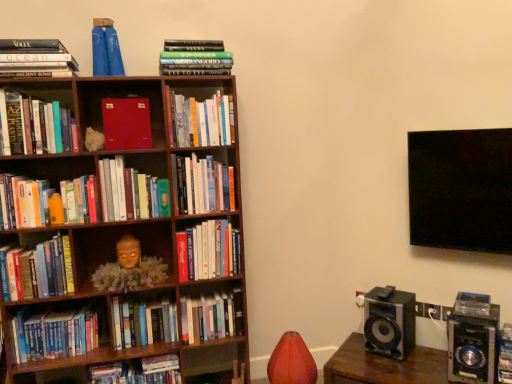
What do you see at coordinates (37, 270) in the screenshot?
I see `hardcover book at left, arranged as the first book when viewed from the left` at bounding box center [37, 270].

This screenshot has height=384, width=512. Identify the location of hardcover book at lower left, which ranks as the 4th book in left-to-right order. (53, 335).

Describe the element at coordinates (385, 366) in the screenshot. The image size is (512, 384). I see `wooden speaker at lower right` at that location.

In order to face hardcover book at center, acting as the 11th book starting from the left, should I rotate leftwards or rightwards?

It's best to rotate left around 7.619 degrees.

What do you see at coordinates (195, 58) in the screenshot? I see `hardcover books at upper center, which is the tenth book in left-to-right order` at bounding box center [195, 58].

The image size is (512, 384). Identify the location of hardcover book at left, placed as the fifteenth book when sorted from right to left. (37, 270).

Is green matte book at center, which ranks as the 8th book in right-to-left order, looking in the opposite direction of hardcover book at lower left, which ranks as the 4th book in left-to-right order?

No, green matte book at center, which ranks as the 8th book in right-to-left order, is not facing away from hardcover book at lower left, which ranks as the 4th book in left-to-right order.

From the image's perspective, is green matte book at center, which ranks as the 8th book in left-to-right order, above hardcover book at lower left, which ranks as the 4th book in left-to-right order?

Yes, from the image's perspective, green matte book at center, which ranks as the 8th book in left-to-right order, is above hardcover book at lower left, which ranks as the 4th book in left-to-right order.

Can we say green matte book at center, which ranks as the 8th book in left-to-right order, lies outside hardcover book at lower left, which ranks as the 4th book in left-to-right order?

Yes.

Does hardcover book at upper left, which is the 14th book in right-to-left order, touch metallic silver speaker at lower right, positioned as the second speaker in right-to-left order?

hardcover book at upper left, which is the 14th book in right-to-left order, and metallic silver speaker at lower right, positioned as the second speaker in right-to-left order, are clearly separated.

Is hardcover book at upper left, the second book when ordered from left to right, aimed at metallic silver speaker at lower right, positioned as the second speaker in right-to-left order?

No, hardcover book at upper left, the second book when ordered from left to right, does not turn towards metallic silver speaker at lower right, positioned as the second speaker in right-to-left order.

Between point (38, 76) and point (397, 303), which one is positioned in front?

Positioned in front is point (38, 76).

From the image's perspective, which one is positioned lower, hardcover book at upper left, the second book when ordered from left to right, or metallic silver speaker at lower right, positioned as the second speaker in right-to-left order?

metallic silver speaker at lower right, positioned as the second speaker in right-to-left order, appears lower in the image.

Considering the sizes of objects hardcover book at left, the thirteenth book positioned from the right, and metallic silver speaker at lower right, positioned as the second speaker in right-to-left order, in the image provided, who is thinner, hardcover book at left, the thirteenth book positioned from the right, or metallic silver speaker at lower right, positioned as the second speaker in right-to-left order,?

hardcover book at left, the thirteenth book positioned from the right.

From a real-world perspective, is hardcover book at left, the thirteenth book positioned from the right, physically above metallic silver speaker at lower right, positioned as the second speaker in right-to-left order?

Yes, from a real-world perspective, hardcover book at left, the thirteenth book positioned from the right, is on top of metallic silver speaker at lower right, positioned as the second speaker in right-to-left order.

In the image, is hardcover book at left, arranged as the third book when viewed from the left, on the left side or the right side of metallic silver speaker at lower right, the first speaker positioned from the left?

Based on their positions, hardcover book at left, arranged as the third book when viewed from the left, is located to the left of metallic silver speaker at lower right, the first speaker positioned from the left.

Does hardcover book at center, the 9th book from the right, touch hardcover book at center, which is the 13th book in left-to-right order?

No.

Which of these two, hardcover book at center, the 9th book from the right, or hardcover book at center, which is the 13th book in left-to-right order, is bigger?

Bigger between the two is hardcover book at center, the 9th book from the right.

Which is behind, hardcover book at center, the seventh book in the left-to-right sequence, or hardcover book at center, which is the 13th book in left-to-right order?

hardcover book at center, which is the 13th book in left-to-right order.

Based on their sizes in the image, would you say matte gold mask at center-left is bigger or smaller than hardcover book at upper left, the second book when ordered from left to right?

Considering their sizes, matte gold mask at center-left takes up more space than hardcover book at upper left, the second book when ordered from left to right.

From the image's perspective, is matte gold mask at center-left on hardcover book at upper left, the second book when ordered from left to right?

Actually, matte gold mask at center-left appears below hardcover book at upper left, the second book when ordered from left to right, in the image.

Is matte gold mask at center-left oriented away from hardcover book at upper left, which is the 14th book in right-to-left order?

No, matte gold mask at center-left is not facing away from hardcover book at upper left, which is the 14th book in right-to-left order.

Based on the photo, is matte gold mask at center-left to the right of hardcover book at upper left, which is the 14th book in right-to-left order, from the viewer's perspective?

Yes, matte gold mask at center-left is to the right of hardcover book at upper left, which is the 14th book in right-to-left order.

Considering the positions of point (373, 366) and point (404, 295), is point (373, 366) closer or farther from the camera than point (404, 295)?

Point (373, 366) is closer to the camera than point (404, 295).

Does wooden speaker at lower right have a larger size compared to metallic silver speaker at lower right, positioned as the second speaker in right-to-left order?

Yes, wooden speaker at lower right is bigger than metallic silver speaker at lower right, positioned as the second speaker in right-to-left order.

From the image's perspective, is wooden speaker at lower right above or below metallic silver speaker at lower right, positioned as the second speaker in right-to-left order?

Clearly, from the image's perspective, wooden speaker at lower right is below metallic silver speaker at lower right, positioned as the second speaker in right-to-left order.

Is wooden speaker at lower right touching metallic silver speaker at lower right, positioned as the second speaker in right-to-left order?

No, wooden speaker at lower right is not in contact with metallic silver speaker at lower right, positioned as the second speaker in right-to-left order.

Is point (133, 317) closer to viewer compared to point (3, 285)?

No, (133, 317) is behind (3, 285).

Based on the photo, from the image's perspective, is hardcover book at center, arranged as the 9th book when viewed from the left, above or below hardcover book at left, arranged as the first book when viewed from the left?

hardcover book at center, arranged as the 9th book when viewed from the left, is situated lower than hardcover book at left, arranged as the first book when viewed from the left, in the image.

Can you confirm if hardcover book at center, arranged as the 9th book when viewed from the left, is wider than hardcover book at left, placed as the fifteenth book when sorted from right to left?

In fact, hardcover book at center, arranged as the 9th book when viewed from the left, might be narrower than hardcover book at left, placed as the fifteenth book when sorted from right to left.

Starting from the hardcover book at lower left, which ranks as the 4th book in left-to-right order, which book is the 3rd one in front? Please provide its 2D coordinates.

[(131, 192)]

Starting from the hardcover book at upper left, the second book when ordered from left to right, which speaker is the 1st one to the right? Please provide its 2D coordinates.

[(389, 322)]

Estimate the real-world distances between objects in this image. Which object is closer to hardcover book at lower left, marked as the twelfth book in a right-to-left arrangement, matte red book at center-left, the 10th book in the right-to-left sequence, or hardcover book at center, which is the 13th book in left-to-right order?

hardcover book at center, which is the 13th book in left-to-right order.

Which object lies further to the anchor point hardcover book at left, the thirteenth book positioned from the right, hardcover book at center, acting as the 11th book starting from the left, or hardcover book at center, the 9th book from the right?

hardcover book at center, the 9th book from the right, is further to hardcover book at left, the thirteenth book positioned from the right.

From the image, which object appears to be nearer to hardcover book at center, acting as the 11th book starting from the left, wooden bookcase at left or hardcover book at left, the thirteenth book positioned from the right?

wooden bookcase at left is positioned closer to the anchor hardcover book at center, acting as the 11th book starting from the left.

From the image, which object appears to be nearer to hardcover book at center, which ranks as the 3th book in right-to-left order, wooden speaker at lower right or green matte book at center, which ranks as the 8th book in right-to-left order?

Based on the image, green matte book at center, which ranks as the 8th book in right-to-left order, appears to be nearer to hardcover book at center, which ranks as the 3th book in right-to-left order.

When comparing their distances from wooden speaker at lower right, does hardcover book at left, arranged as the first book when viewed from the left, or velvet red bean bag chair at lower center seem closer?

Based on the image, velvet red bean bag chair at lower center appears to be nearer to wooden speaker at lower right.

When comparing their distances from hardcover book at center, arranged as the 9th book when viewed from the left, does hardcover book at center, which ranks as the 3th book in right-to-left order, or wooden speaker at lower right seem closer?

hardcover book at center, which ranks as the 3th book in right-to-left order, lies closer to hardcover book at center, arranged as the 9th book when viewed from the left, than the other object.

Based on the photo, estimate the real-world distances between objects in this image. Which object is further from matte gold mask at center-left, metallic silver speaker at lower right, positioned as the second speaker in right-to-left order, or hardcover book at upper left, the second book when ordered from left to right?

Among the two, metallic silver speaker at lower right, positioned as the second speaker in right-to-left order, is located further to matte gold mask at center-left.

From the image, which object appears to be nearer to hardcover books at upper center, the sixth book in the right-to-left sequence, hardcover book at left, arranged as the third book when viewed from the left, or hardcover book at center, which ranks as the 14th book in left-to-right order?

hardcover book at left, arranged as the third book when viewed from the left.

I want to click on person between hardcover book at center, the 12th book from the left, and velvet red bean bag chair at lower center vertically, so click(129, 269).

This screenshot has width=512, height=384. I want to click on bookcase between hardcover books at upper center, which is the tenth book in left-to-right order, and hardcover book at center, the 9th book from the right, in the vertical direction, so click(x=116, y=241).

Identify the location of bean bag chair between matte gold mask at center-left and metallic silver speaker at lower right, the 2th speaker in the left-to-right sequence, from left to right. Image resolution: width=512 pixels, height=384 pixels. (291, 361).

In order to click on furniture situated between hardcover book at upper left, the second book when ordered from left to right, and metallic silver speaker at lower right, the 2th speaker in the left-to-right sequence, from left to right in this screenshot , I will do `click(385, 366)`.